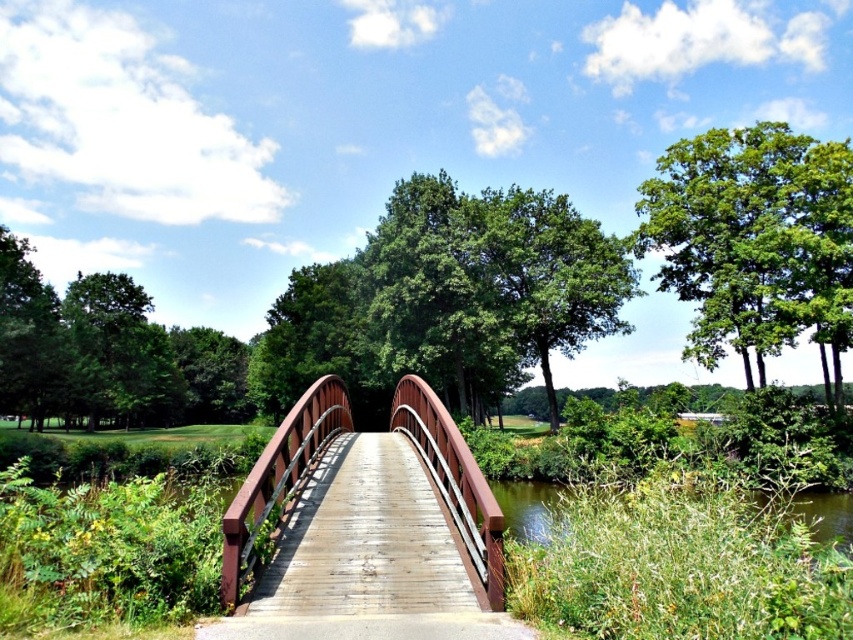
Does point (450, 451) come in front of point (701, 259)?

That is True.

What do you see at coordinates (366, 525) in the screenshot?
I see `wooden bridge at center` at bounding box center [366, 525].

Between point (276, 604) and point (836, 227), which one is positioned behind?

The point (836, 227) is behind.

In order to click on wooden bridge at center in this screenshot , I will do `click(366, 525)`.